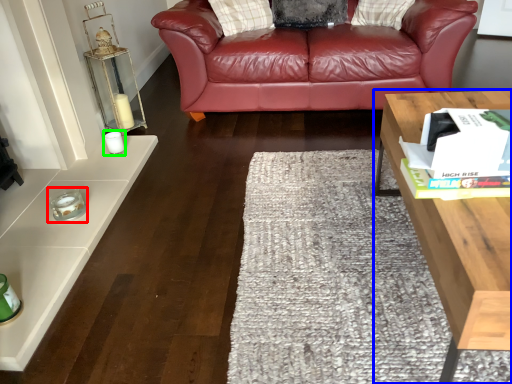
Question: Considering the real-world distances, which object is farthest from candle holder (highlighted by a red box)? table (highlighted by a blue box) or candle holder (highlighted by a green box)?

Choices:
 (A) table
 (B) candle holder

Answer: (A)